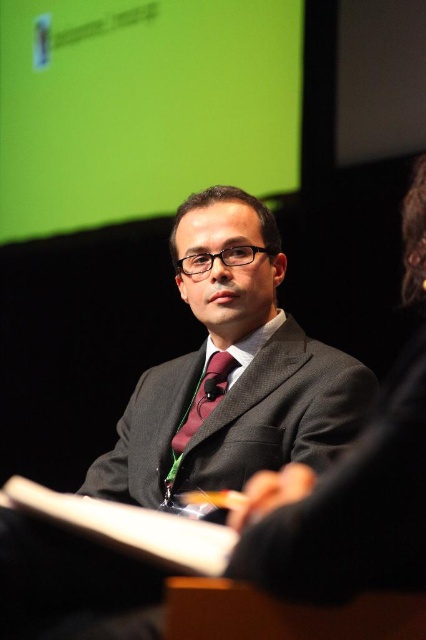
Who is taller, dark gray suit at center or maroon satin tie at center?

dark gray suit at center is taller.

Which is below, dark gray suit at center or maroon satin tie at center?

Positioned lower is maroon satin tie at center.

Who is more forward, (204,356) or (175,444)?

Point (175,444)

The height and width of the screenshot is (640, 426). In order to click on dark gray suit at center in this screenshot , I will do `click(232, 371)`.